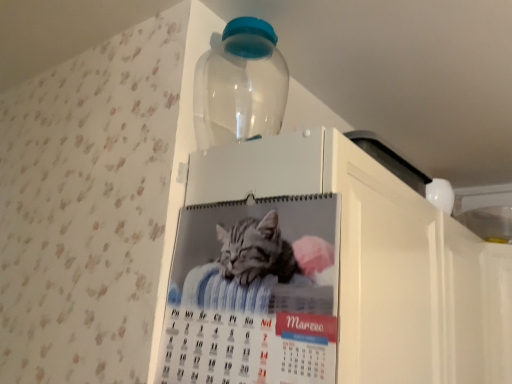
What do you see at coordinates (327, 275) in the screenshot? The width and height of the screenshot is (512, 384). I see `white glossy calendar at upper center` at bounding box center [327, 275].

You are a GUI agent. You are given a task and a screenshot of the screen. Output one action in this format:
    pyautogui.click(x=<x>, y=<y>)
    Task: Click on the transparent plastic bottle at upper center
    
    Given the screenshot: What is the action you would take?
    (240, 85)

Where is `white glossy calendar at upper center`? white glossy calendar at upper center is located at coordinates (327, 275).

Measure the distance from transparent plastic bottle at upper center to white glossy calendar at upper center.

transparent plastic bottle at upper center is 12.13 inches away from white glossy calendar at upper center.

Does transparent plastic bottle at upper center have a lesser height compared to white glossy calendar at upper center?

Yes, transparent plastic bottle at upper center is shorter than white glossy calendar at upper center.

Would you say transparent plastic bottle at upper center is to the left or to the right of white glossy calendar at upper center in the picture?

transparent plastic bottle at upper center is positioned on white glossy calendar at upper center's left side.

Which of these two, transparent plastic bottle at upper center or white glossy calendar at upper center, is bigger?

With larger size is white glossy calendar at upper center.

Is point (271, 93) closer or farther from the camera than point (298, 369)?

Clearly, point (271, 93) is more distant from the camera than point (298, 369).

Looking at this image, from their relative heights in the image, would you say transparent plastic bottle at upper center is taller or shorter than printed paper calendar at center?

Clearly, transparent plastic bottle at upper center is shorter compared to printed paper calendar at center.

Could printed paper calendar at center be considered to be inside transparent plastic bottle at upper center?

No, printed paper calendar at center is not a part of transparent plastic bottle at upper center.

In the image, is transparent plastic bottle at upper center on the left side or the right side of printed paper calendar at center?

transparent plastic bottle at upper center is positioned on printed paper calendar at center's right side.

What's the angular difference between white glossy calendar at upper center and printed paper calendar at center's facing directions?

There is a 88.9-degree angle between the facing directions of white glossy calendar at upper center and printed paper calendar at center.

How distant is white glossy calendar at upper center from printed paper calendar at center?

They are 7.92 centimeters apart.

Would you say white glossy calendar at upper center is outside printed paper calendar at center?

Yes.

Can you see white glossy calendar at upper center touching printed paper calendar at center?

Yes, white glossy calendar at upper center is right next to printed paper calendar at center and making contact.

Is white glossy calendar at upper center facing away from transparent plastic bottle at upper center?

white glossy calendar at upper center is not turned away from transparent plastic bottle at upper center.

From the picture: Is transparent plastic bottle at upper center a part of white glossy calendar at upper center?

No, transparent plastic bottle at upper center is located outside of white glossy calendar at upper center.

From a real-world perspective, which object rests below the other?

white glossy calendar at upper center, from a real-world perspective.

Could you tell me if printed paper calendar at center is turned towards transparent plastic bottle at upper center?

No, printed paper calendar at center is not aimed at transparent plastic bottle at upper center.

From the image's perspective, is printed paper calendar at center over transparent plastic bottle at upper center?

No, from the image's perspective, printed paper calendar at center is not above transparent plastic bottle at upper center.

In terms of size, does printed paper calendar at center appear bigger or smaller than transparent plastic bottle at upper center?

printed paper calendar at center is smaller than transparent plastic bottle at upper center.

Is printed paper calendar at center at the right side of white glossy calendar at upper center?

In fact, printed paper calendar at center is to the left of white glossy calendar at upper center.

Measure the distance from printed paper calendar at center to white glossy calendar at upper center.

printed paper calendar at center is 3.12 inches from white glossy calendar at upper center.

Is printed paper calendar at center located outside white glossy calendar at upper center?

Absolutely, printed paper calendar at center is external to white glossy calendar at upper center.

Are printed paper calendar at center and white glossy calendar at upper center making contact?

Yes, printed paper calendar at center is with white glossy calendar at upper center.

Locate an element on the screen. This screenshot has height=384, width=512. bottle located above the white glossy calendar at upper center (from the image's perspective) is located at coordinates (240, 85).

This screenshot has height=384, width=512. I want to click on poster below the transparent plastic bottle at upper center (from the image's perspective), so click(249, 302).

From the image, which object appears to be nearer to transparent plastic bottle at upper center, white glossy calendar at upper center or printed paper calendar at center?

white glossy calendar at upper center.

Considering their positions, is printed paper calendar at center positioned further to white glossy calendar at upper center than transparent plastic bottle at upper center?

transparent plastic bottle at upper center is positioned further to the anchor white glossy calendar at upper center.

Considering their positions, is printed paper calendar at center positioned further to transparent plastic bottle at upper center than white glossy calendar at upper center?

printed paper calendar at center lies further to transparent plastic bottle at upper center than the other object.

Looking at the image, which one is located closer to white glossy calendar at upper center, transparent plastic bottle at upper center or printed paper calendar at center?

The object closer to white glossy calendar at upper center is printed paper calendar at center.

From the image, which object appears to be farther from printed paper calendar at center, transparent plastic bottle at upper center or white glossy calendar at upper center?

transparent plastic bottle at upper center lies further to printed paper calendar at center than the other object.

Based on their spatial positions, is white glossy calendar at upper center or transparent plastic bottle at upper center further from printed paper calendar at center?

transparent plastic bottle at upper center is further to printed paper calendar at center.

This screenshot has height=384, width=512. I want to click on poster between transparent plastic bottle at upper center and white glossy calendar at upper center in the up-down direction, so click(249, 302).